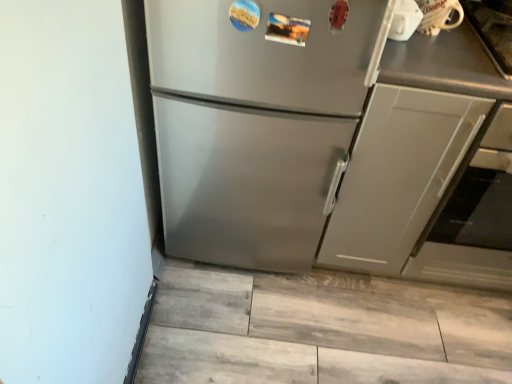
At what (x,y) coordinates should I click in order to perform the action: click on free space in front of white glossy mug at upper right. Please return your answer as a coordinate pair (x, y). Looking at the image, I should click on (441, 61).